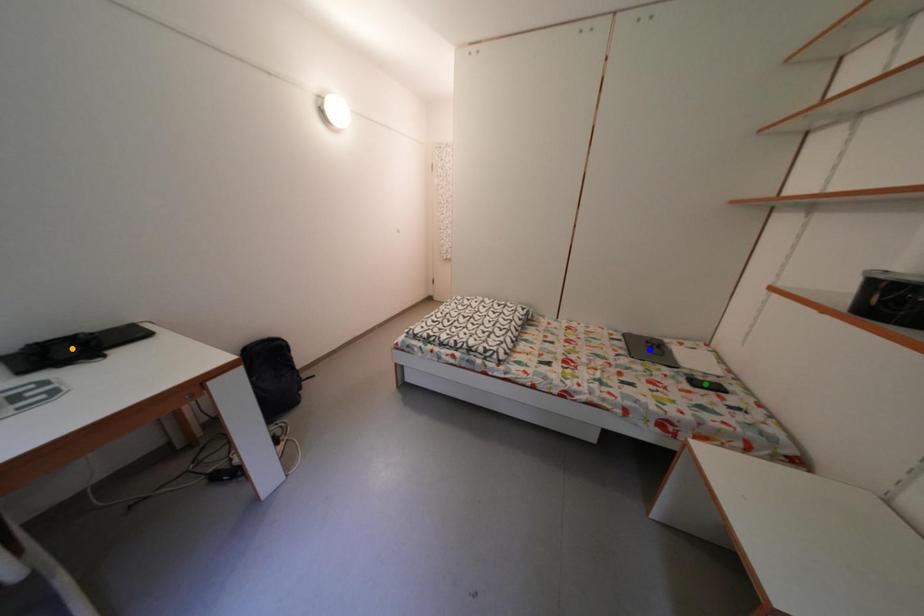
Order these from nearest to farthest:
A) blue point
B) orange point
C) green point

blue point → green point → orange point